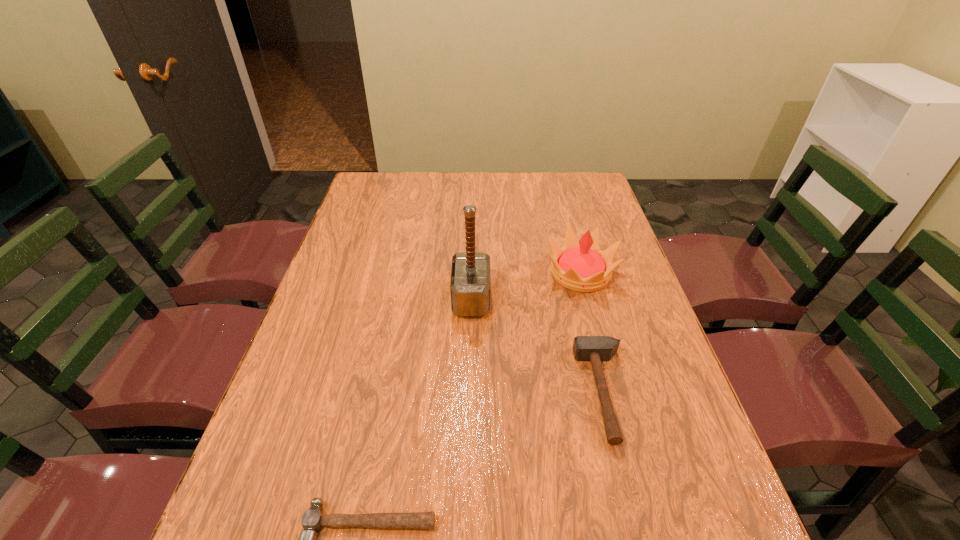
This screenshot has width=960, height=540. I want to click on crown that is at the right edge, so click(x=583, y=267).

The image size is (960, 540). In order to click on hammer at the right edge in this screenshot , I will do `click(585, 348)`.

In the image, there is a desktop. Where is `free space at the far edge`? free space at the far edge is located at coordinates (484, 177).

The width and height of the screenshot is (960, 540). Find the location of `vacant space at the left edge of the desktop`. vacant space at the left edge of the desktop is located at coordinates (334, 284).

You are a GUI agent. You are given a task and a screenshot of the screen. Output one action in this format:
    pyautogui.click(x=<x>, y=<y>)
    Task: Click on the vacant space at the right edge of the desktop
    
    Given the screenshot: What is the action you would take?
    pyautogui.click(x=669, y=402)

I want to click on vacant space at the far left corner, so click(x=373, y=178).

Where is `vacant region at the far right corner of the desktop`? Image resolution: width=960 pixels, height=540 pixels. vacant region at the far right corner of the desktop is located at coordinates tap(580, 185).

This screenshot has width=960, height=540. I want to click on vacant region between the second shortest object and the farthest hammer, so tap(538, 346).

What are the coordinates of `unoccupied position between the rightmost hammer and the third shortest object` in the screenshot? It's located at (592, 333).

Image resolution: width=960 pixels, height=540 pixels. I want to click on vacant space that is in between the third shortest object and the rightmost hammer, so click(592, 333).